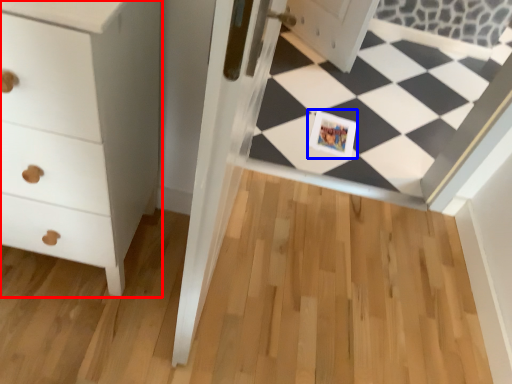
Question: Which object is closer to the camera taking this photo, chest of drawers (highlighted by a red box) or postcard (highlighted by a blue box)?

Choices:
 (A) chest of drawers
 (B) postcard

Answer: (A)